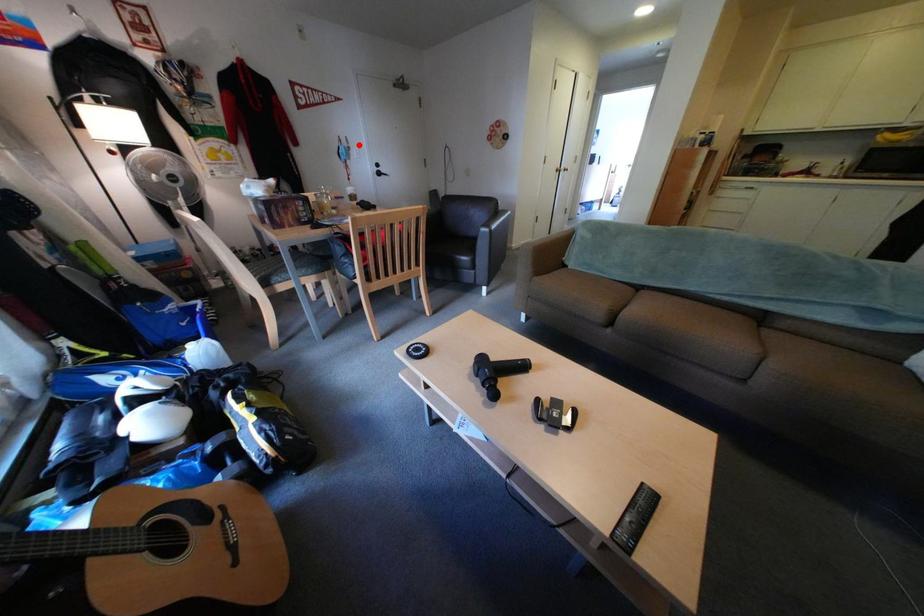
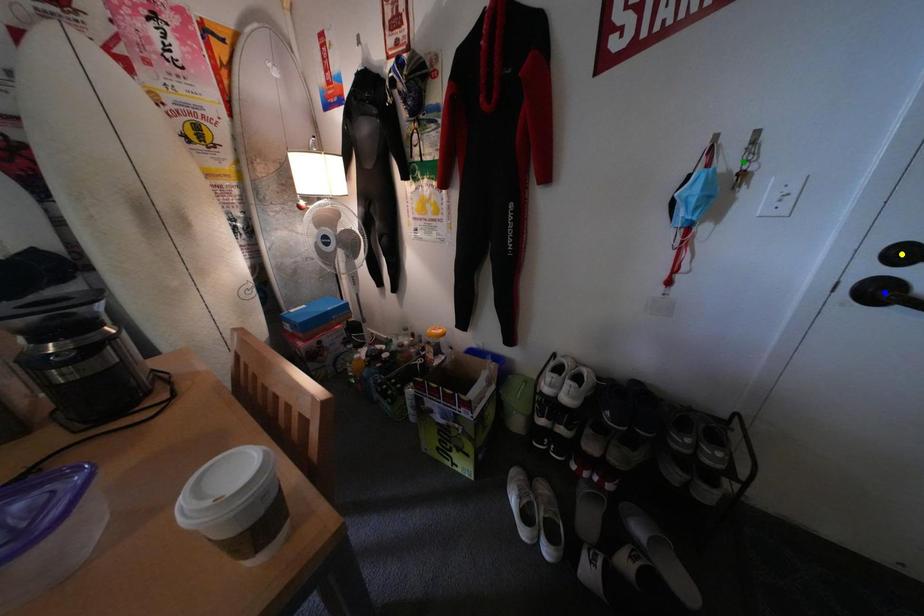
Question: I am providing you with two images of the same scene from different viewpoints. A red point is marked on the first image. You are given multiple points on the second image. Which point in image 2 represents the same 3d spot as the red point in image 1?

Choices:
 (A) blue point
 (B) green point
 (C) yellow point

Answer: (B)